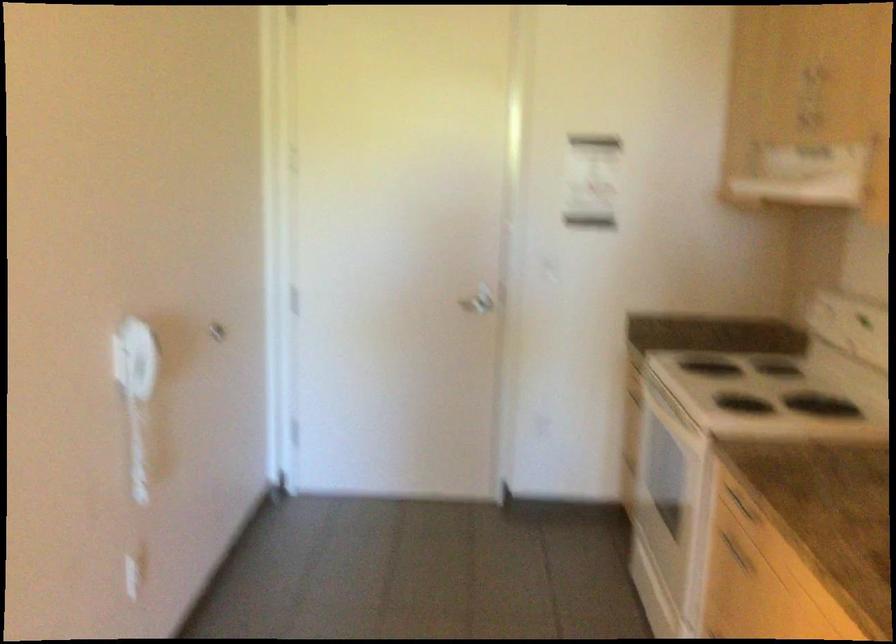
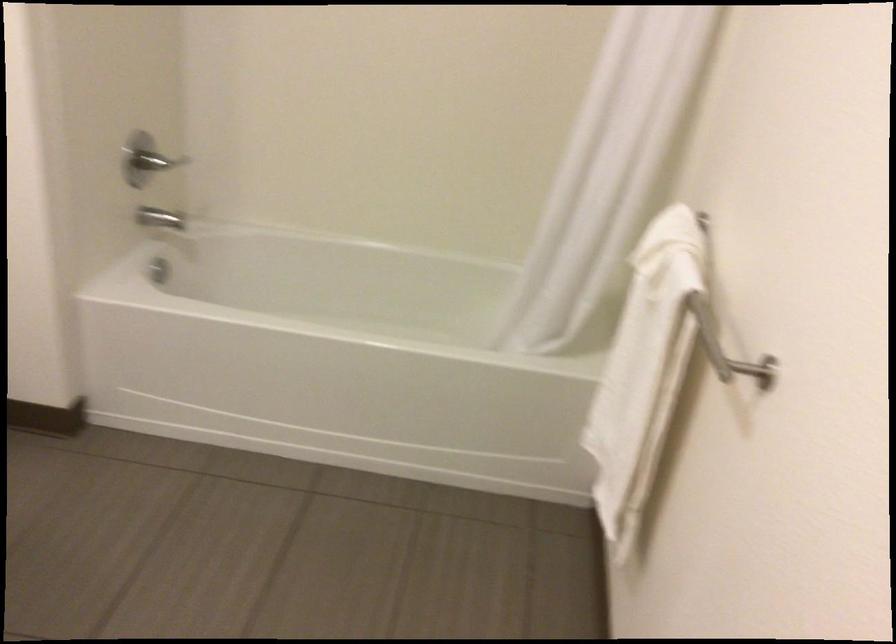
What movement of the cameraman would produce the second image?

The cameraman walked toward left, forward.